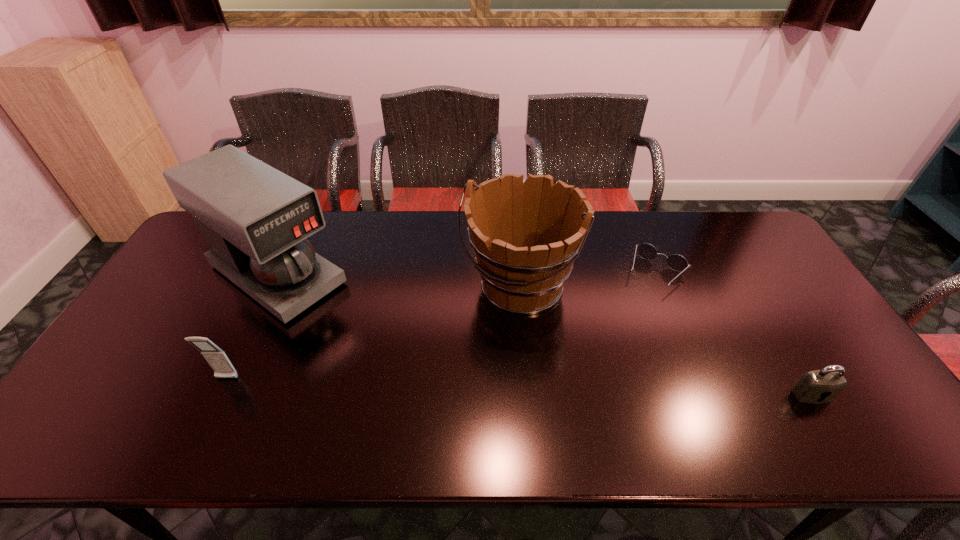
Image resolution: width=960 pixels, height=540 pixels. Identify the location of free space on the desktop that is between the second nearest object and the padlock and is positioned on the carafe side of the coffee maker. (430, 384).

The height and width of the screenshot is (540, 960). In order to click on vacant spot on the desktop that is between the third shortest object and the rightmost object and is positioned on the front-facing side of the spectacles in this screenshot , I will do `click(589, 389)`.

This screenshot has height=540, width=960. I want to click on free spot on the desktop that is between the second nearest object and the rightmost object and is positioned with the handle on the third object from right to left, so click(x=457, y=385).